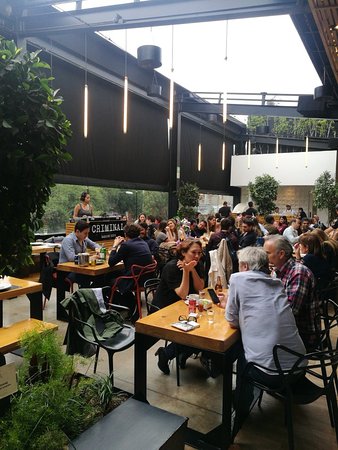
The width and height of the screenshot is (338, 450). What are the coordinates of `window` in the screenshot? It's located at (101, 203), (208, 199).